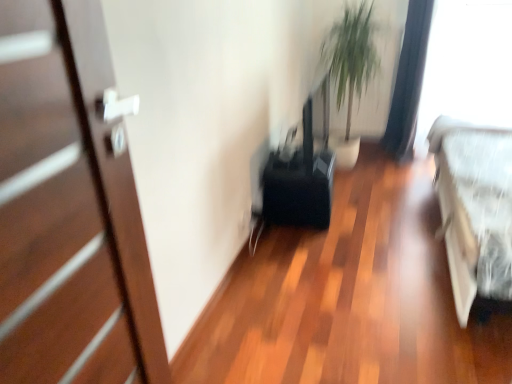
Question: From a real-world perspective, is green leafy plant at upper center above or below matte white door at left?

Choices:
 (A) above
 (B) below

Answer: (B)

Question: Relative to matte white door at left, is green leafy plant at upper center in front or behind?

Choices:
 (A) behind
 (B) front

Answer: (A)

Question: Which is nearer to the matte white door at left?

Choices:
 (A) white fabric bed at right
 (B) transparent plastic window screen at upper right
 (C) black fabric curtain at upper right
 (D) green leafy plant at upper center

Answer: (A)

Question: Which is farther from the black fabric curtain at upper right?

Choices:
 (A) green leafy plant at upper center
 (B) transparent plastic window screen at upper right
 (C) matte white door at left
 (D) white fabric bed at right

Answer: (C)